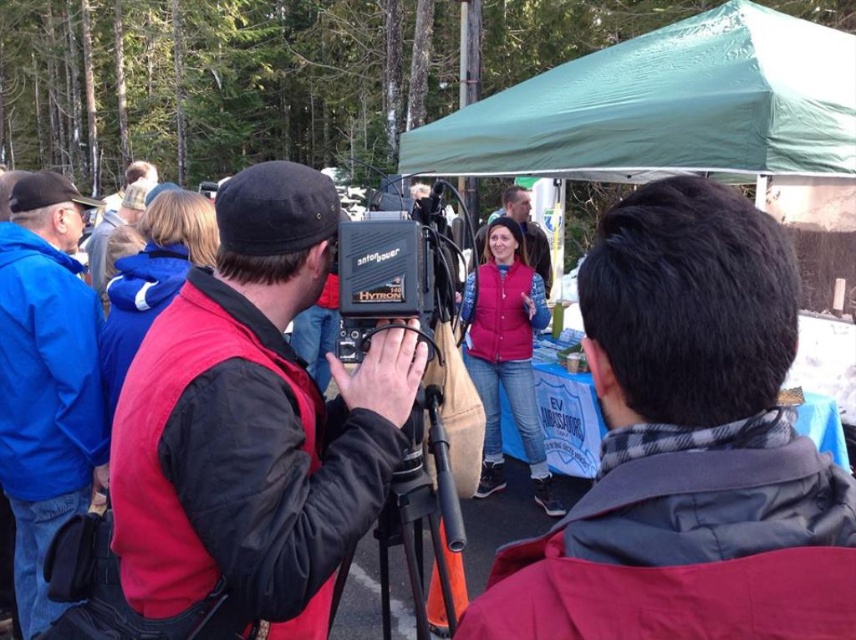
You are a photographer trying to set up your equipment. You have a matte black camera at center and a blue fleece jacket at left. According to the scene, which item is positioned higher?

The matte black camera at center is above the blue fleece jacket at left, so it is positioned higher.

You are a photographer at the event and need to take a picture of the matte black vest at center. However, the blue fleece jacket at left is blocking your view. Which direction should you move to avoid the obstruction?

Move to the right of the blue fleece jacket at left since it is positioned to the left of the matte black vest at center, allowing you to see the matte black vest at center without obstruction.

You are a photographer setting up equipment in the forest. You have a green fabric canopy at upper center and a blue fleece jacket at left. Which object would cast a larger shadow when the sun is directly overhead?

The green fabric canopy at upper center would cast a larger shadow than the blue fleece jacket at left because it is bigger in size.